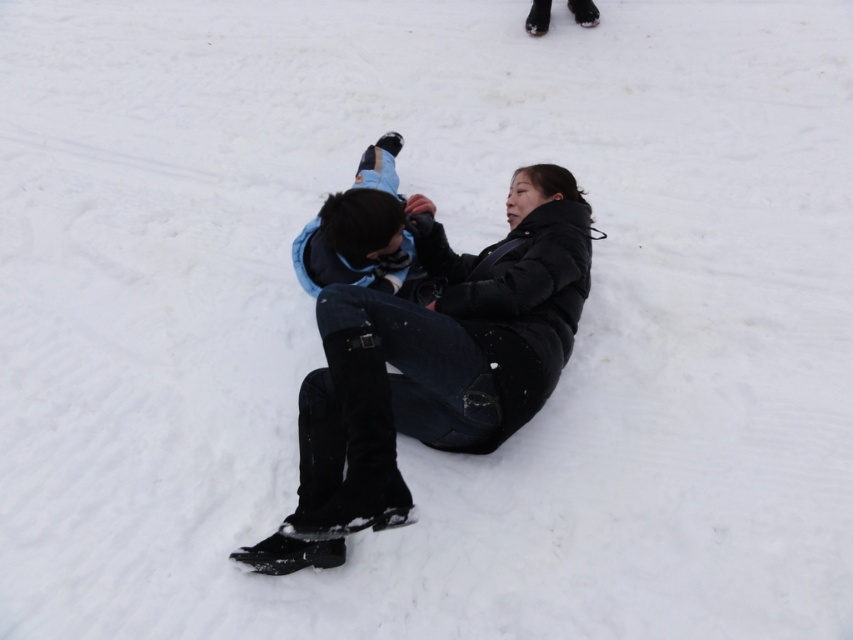
Question: Which point appears closest to the camera in this image?

Choices:
 (A) (299, 529)
 (B) (415, 280)

Answer: (A)

Question: Is black matte jacket at center to the left of light blue denim snowboard at center from the viewer's perspective?

Choices:
 (A) yes
 (B) no

Answer: (B)

Question: Among these points, which one is farthest from the camera?

Choices:
 (A) (403, 268)
 (B) (544, 358)

Answer: (A)

Question: Does black matte jacket at center appear over light blue denim snowboard at center?

Choices:
 (A) no
 (B) yes

Answer: (A)

Question: In this image, where is black matte jacket at center located relative to light blue denim snowboard at center?

Choices:
 (A) above
 (B) below

Answer: (B)